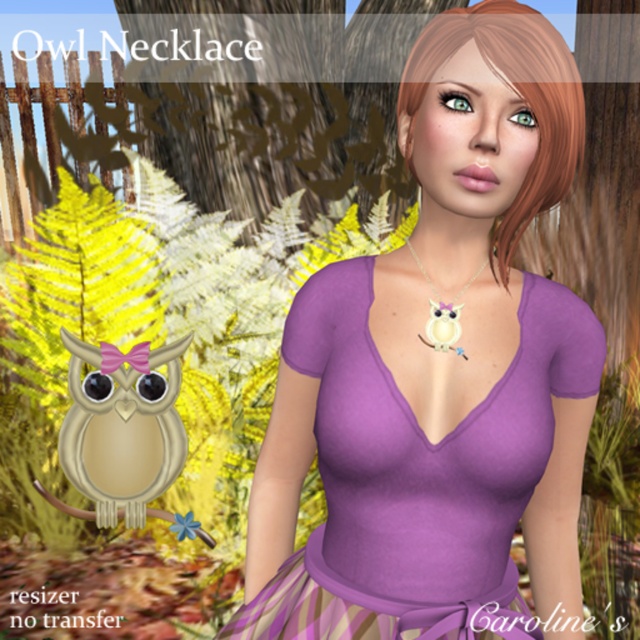
You are standing 1.15 meters away from the point at coordinates (579,346) in the image. Can you see the owl necklace clearly?

Yes, since you are exactly 1.15 meters away from the point at coordinates (579,346), which is the location of the owl necklace, you can see it clearly.

You are a photographer trying to capture the owl necklace in the advertisement. Since the purple matte dress at center and the matte beige owl at center are both in the frame, which one is closer to the camera?

The purple matte dress at center is in front of the matte beige owl at center, so the purple matte dress at center is closer to the camera.

You are a jewelry designer trying to position the matte white owl at center necklace correctly on a mannequin wearing a purple matte dress at center. According to the image, where should the owl necklace be placed relative to the dress?

The purple matte dress at center is to the left of the matte white owl at center, so the owl necklace should be positioned to the right of the purple matte dress at center.